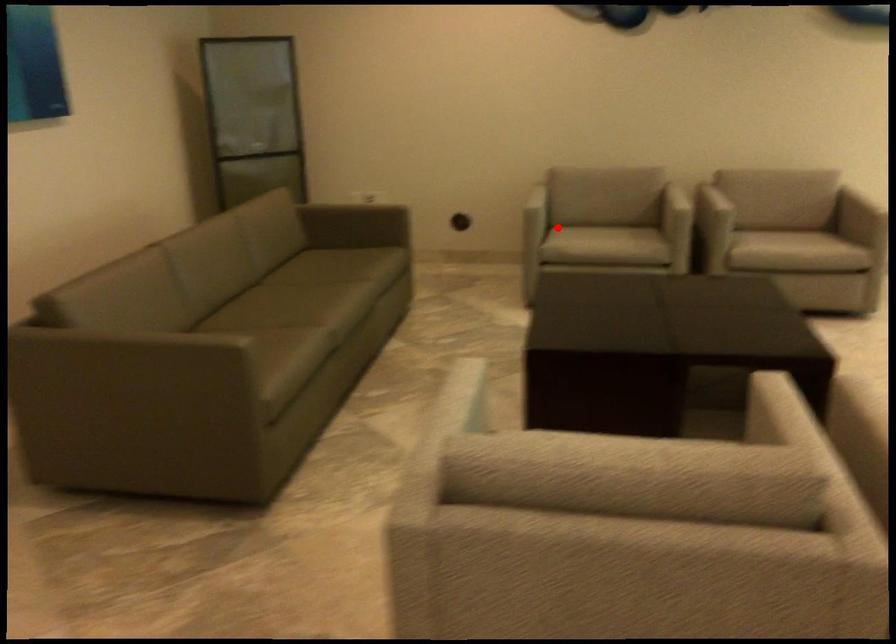
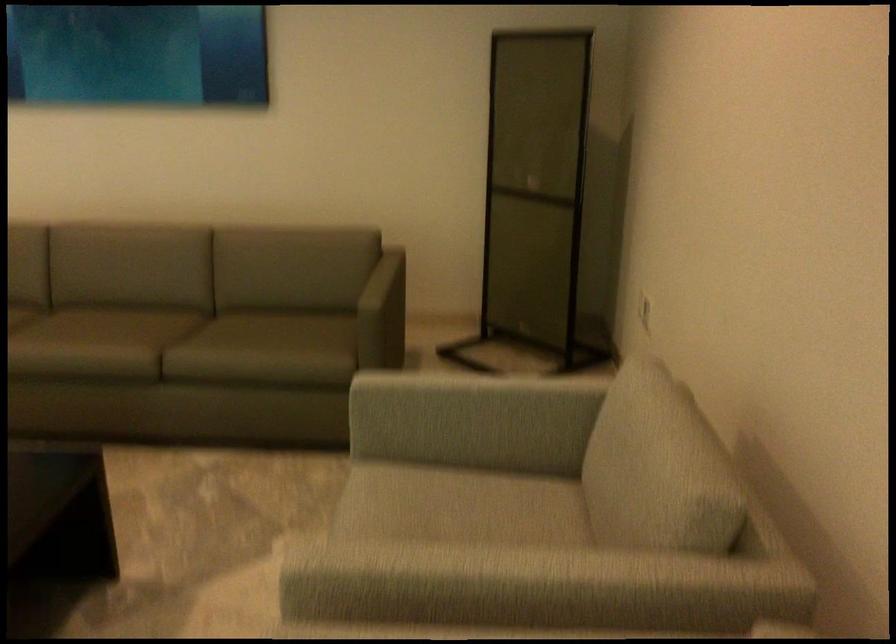
Question: I am providing you with two images of the same scene from different viewpoints. Given a red point in image1, look at the same physical point in image2. Is it:

Choices:
 (A) Closer to the viewpoint
 (B) Farther from the viewpoint

Answer: (A)